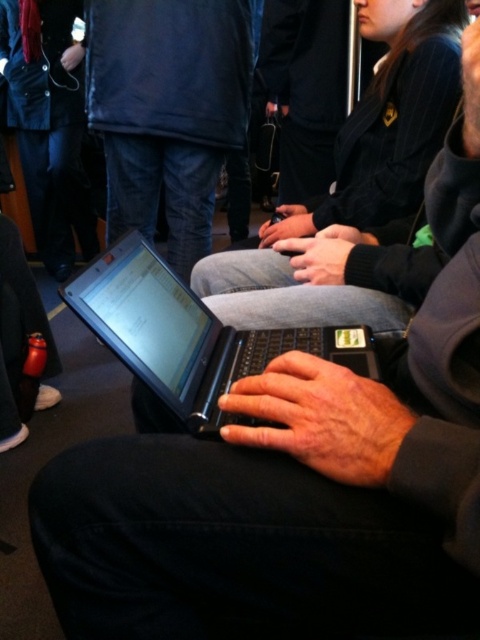
Does matte black laptop at center appear over black glossy laptop at center?

Indeed, matte black laptop at center is positioned over black glossy laptop at center.

Which is behind, point (201, 28) or point (163, 284)?

Point (201, 28)

Who is more forward, (88,26) or (245,372)?

Positioned in front is point (245,372).

Locate an element on the screen. This screenshot has width=480, height=640. matte black laptop at center is located at coordinates (168, 108).